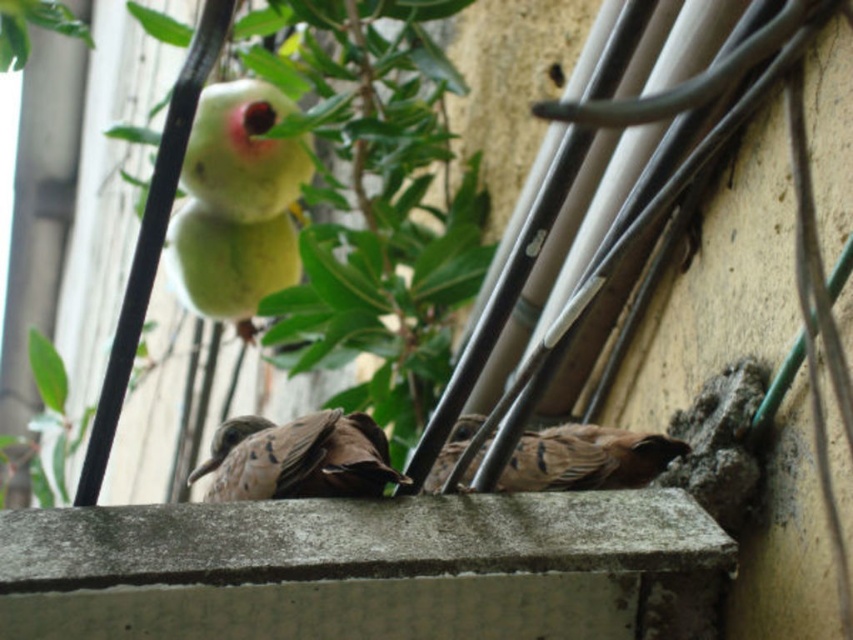
Is point (354, 442) more distant than point (465, 484)?

That is False.

Find the location of a particular element. brown feathered bird at center is located at coordinates (299, 458).